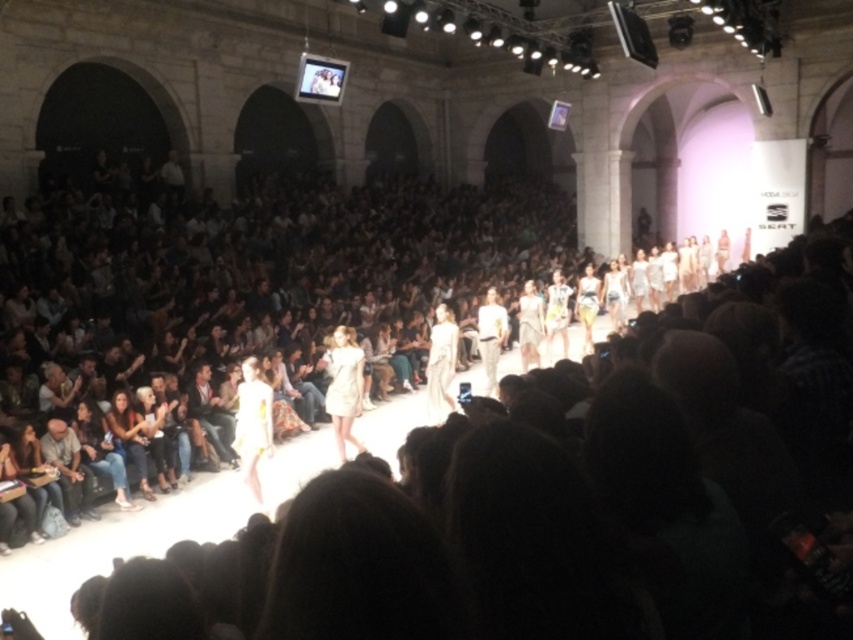
In the scene shown: You are a fashion designer observing the runway. You notice the light brown leather jacket at lower left and the white cotton shirt at center. Which of these two items appears to be smaller in size?

The light brown leather jacket at lower left has a smaller size compared to the white cotton shirt at center, so the light brown leather jacket at lower left appears to be smaller in size.

You are a photographer positioned at the entrance of the runway. You want to capture a photo of the white matte dress at center. Where should you aim your camera to ensure the dress is in the frame?

You should aim your camera at the coordinates point (344, 387) where the white matte dress at center is located.

You are a photographer at the fashion show and want to capture a clear shot of both the jeans at lower left and the light brown leather jacket at lower left. Since you can only focus on one object at a time, which one should you choose to ensure the other is still somewhat in focus?

You should focus on the jeans at lower left because it is closer to the viewer than the light brown leather jacket at lower left. By focusing on the closer object, the jacket will still be partially in focus due to the depth of field extending beyond the focal point.